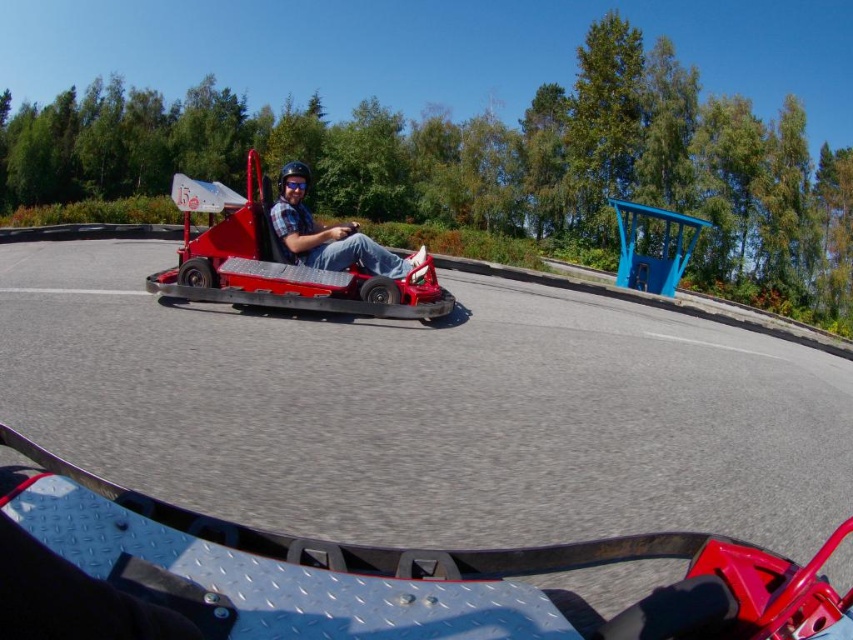
Does smooth asphalt race track at center have a greater height compared to shiny red go-kart at center?

No, smooth asphalt race track at center is not taller than shiny red go-kart at center.

What do you see at coordinates (405, 451) in the screenshot? The height and width of the screenshot is (640, 853). I see `smooth asphalt race track at center` at bounding box center [405, 451].

The height and width of the screenshot is (640, 853). I want to click on smooth asphalt race track at center, so click(x=405, y=451).

Which is more to the left, smooth asphalt race track at center or matte plastic go-kart at center?

From the viewer's perspective, matte plastic go-kart at center appears more on the left side.

Based on the photo, which is more to the right, smooth asphalt race track at center or matte plastic go-kart at center?

Positioned to the right is smooth asphalt race track at center.

Describe the element at coordinates (405, 451) in the screenshot. I see `smooth asphalt race track at center` at that location.

What are the coordinates of `smooth asphalt race track at center` in the screenshot? It's located at (405, 451).

Is shiny red go-kart at center below blue matte goggles at center?

No.

Is point (242, 280) positioned in front of point (303, 177)?

Yes, it is.

Does point (343, 280) lie in front of point (291, 182)?

Yes, point (343, 280) is in front of point (291, 182).

Identify the location of shiny red go-kart at center. The width and height of the screenshot is (853, 640). (277, 262).